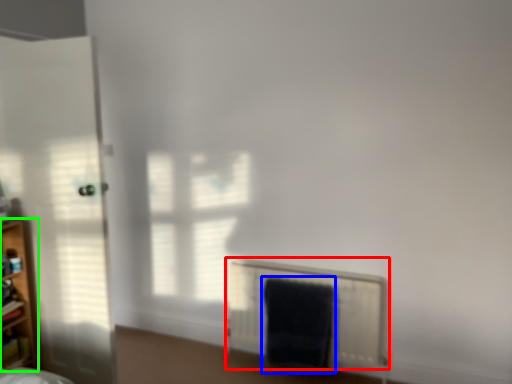
Question: Which object is the closest to the radiator (highlighted by a red box)? Choose among these: bath towel (highlighted by a blue box) or shelf (highlighted by a green box).

Choices:
 (A) bath towel
 (B) shelf

Answer: (A)